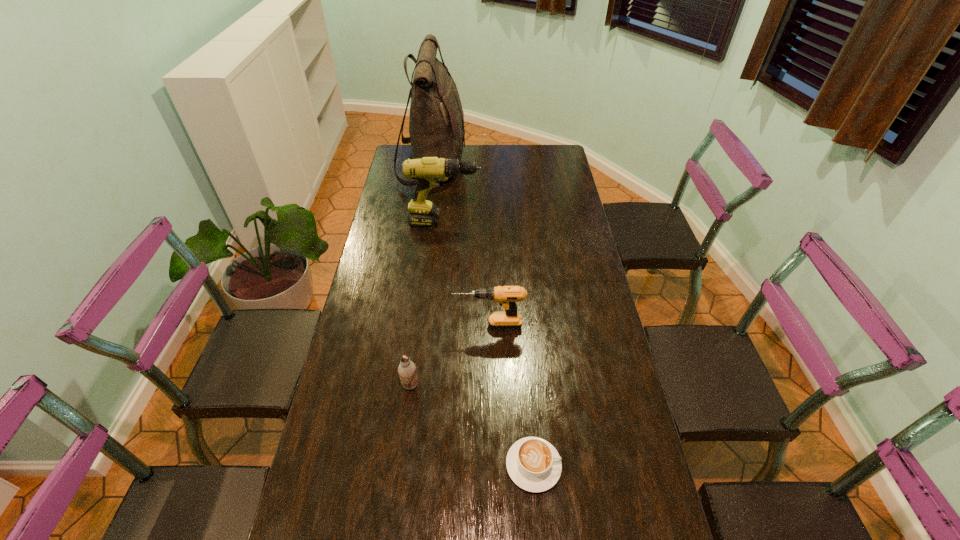
This screenshot has height=540, width=960. I want to click on object positioned at the far left corner, so click(436, 121).

The height and width of the screenshot is (540, 960). In the image, there is a desktop. What are the coordinates of `vacant space at the far edge` in the screenshot? It's located at coord(513,164).

The image size is (960, 540). In the image, there is a desktop. Identify the location of blank space at the left edge. (348, 426).

You are a GUI agent. You are given a task and a screenshot of the screen. Output one action in this format:
    pyautogui.click(x=<x>, y=<y>)
    Task: Click on the vacant space at the right edge
    This screenshot has height=540, width=960.
    Given the screenshot: What is the action you would take?
    pyautogui.click(x=636, y=478)

I want to click on free region at the far left corner, so click(402, 150).

Identify the location of unoccupied position between the cappuccino and the second shortest object. Image resolution: width=960 pixels, height=540 pixels. (471, 426).

At what (x,y) coordinates should I click in order to perform the action: click on empty location between the tallest object and the second nearest object. Please return your answer as a coordinate pair (x, y). This screenshot has height=540, width=960. Looking at the image, I should click on (421, 276).

Identify the location of free space between the tallest object and the second shortest object. (421, 276).

Locate an element on the screen. The height and width of the screenshot is (540, 960). object that is the third closest to the third shortest object is located at coordinates coord(428,171).

Image resolution: width=960 pixels, height=540 pixels. I want to click on object identified as the closest to the backpack, so tap(428, 171).